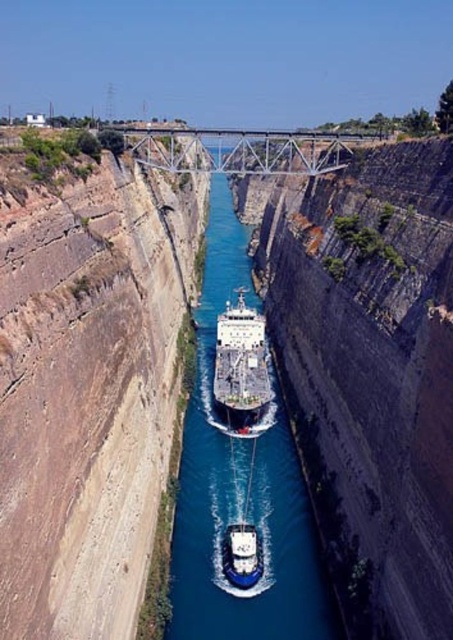
Question: In this image, where is white glossy ship at center located relative to white glossy boat at center?

Choices:
 (A) above
 (B) below

Answer: (A)

Question: Which of these objects is positioned farthest from the blue smooth water at center?

Choices:
 (A) white glossy boat at center
 (B) white glossy ship at center

Answer: (B)

Question: Is the position of blue smooth water at center less distant than that of white glossy ship at center?

Choices:
 (A) yes
 (B) no

Answer: (A)

Question: Among these objects, which one is farthest from the camera?

Choices:
 (A) white glossy ship at center
 (B) blue smooth water at center

Answer: (A)

Question: Estimate the real-world distances between objects in this image. Which object is farther from the blue smooth water at center?

Choices:
 (A) white glossy ship at center
 (B) white glossy boat at center

Answer: (A)

Question: Does blue smooth water at center appear under white glossy ship at center?

Choices:
 (A) no
 (B) yes

Answer: (A)